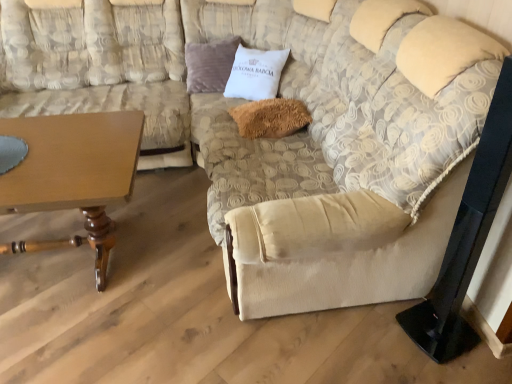
Locate an element on the screen. This screenshot has height=384, width=512. free space above wooden table at lower left (from a real-world perspective) is located at coordinates (66, 160).